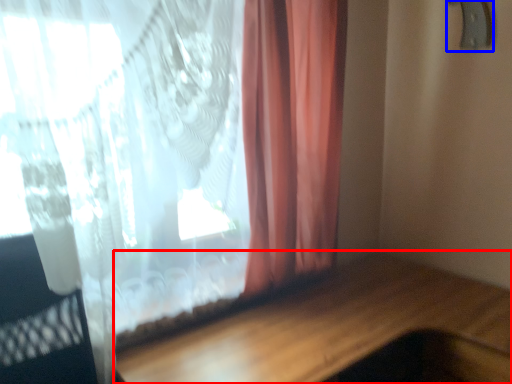
Question: Which of the following is the farthest to the observer, table (highlighted by a red box) or door handle (highlighted by a blue box)?

Choices:
 (A) table
 (B) door handle

Answer: (B)